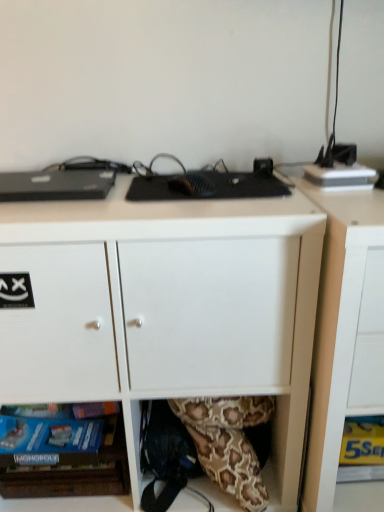
This screenshot has height=512, width=384. I want to click on wooden board games at lower left, so click(x=74, y=472).

Find the location of a particular element. This screenshot has width=384, height=512. yellow paper at lower right is located at coordinates (363, 441).

Image resolution: width=384 pixels, height=512 pixels. Describe the element at coordinates (344, 329) in the screenshot. I see `matte white cabinet at lower right` at that location.

The height and width of the screenshot is (512, 384). Identify the location of wooden board games at lower left. (74, 472).

Looking at their sizes, would you say wooden board games at lower left is wider or thinner than white matte desk at center?

wooden board games at lower left is thinner than white matte desk at center.

Relative to white matte desk at center, is wooden board games at lower left in front or behind?

wooden board games at lower left is positioned farther from the viewer than white matte desk at center.

From a real-world perspective, is wooden board games at lower left physically below white matte desk at center?

Yes.

Which of these two, wooden board games at lower left or white matte desk at center, stands taller?

With more height is white matte desk at center.

In the scene shown: From the image's perspective, does wooden board games at lower left appear lower than matte white cabinet at lower right?

Correct, wooden board games at lower left appears lower than matte white cabinet at lower right in the image.

Does point (88, 471) appear closer or farther from the camera than point (327, 337)?

Point (88, 471) appears to be farther away from the viewer than point (327, 337).

Where is `cabinetry above the wooden board games at lower left (from the image's perspective)`? The width and height of the screenshot is (384, 512). cabinetry above the wooden board games at lower left (from the image's perspective) is located at coordinates (344, 329).

Who is more distant, wooden board games at lower left or matte white cabinet at lower right?

Positioned behind is wooden board games at lower left.

Which is more to the right, yellow paper at lower right or wooden board games at lower left?

Positioned to the right is yellow paper at lower right.

You are a GUI agent. You are given a task and a screenshot of the screen. Output one action in this format:
    pyautogui.click(x=<x>, y=<y>)
    Task: Click on the paperback book on the right of wooden board games at lower left
    Image resolution: width=384 pixels, height=512 pixels.
    Given the screenshot: What is the action you would take?
    [363, 441]

From a real-world perspective, between yellow paper at lower right and wooden board games at lower left, who is vertically higher?

From a 3D spatial view, yellow paper at lower right is above.

Is matte white cabinet at lower right next to white matte desk at center and touching it?

No, matte white cabinet at lower right is not with white matte desk at center.

Between matte white cabinet at lower right and white matte desk at center, which one has larger width?

white matte desk at center is wider.

Is white matte desk at center inside matte white cabinet at lower right?

Definitely not — white matte desk at center is not inside matte white cabinet at lower right.

From the image's perspective, who appears lower, matte white cabinet at lower right or white matte desk at center?

matte white cabinet at lower right.

Image resolution: width=384 pixels, height=512 pixels. I want to click on desk above the yellow paper at lower right (from a real-world perspective), so click(166, 309).

Between point (343, 431) and point (125, 362), which one is positioned in front?

Point (125, 362)

From a real-world perspective, is yellow paper at lower right above or below white matte desk at center?

yellow paper at lower right is below white matte desk at center.

Does yellow paper at lower right turn towards white matte desk at center?

No, yellow paper at lower right does not turn towards white matte desk at center.

Can you confirm if wooden board games at lower left is positioned to the left of yellow paper at lower right?

Correct, you'll find wooden board games at lower left to the left of yellow paper at lower right.

From the image's perspective, which is above, wooden board games at lower left or yellow paper at lower right?

From the image's view, yellow paper at lower right is above.

Is yellow paper at lower right inside wooden board games at lower left?

No, yellow paper at lower right is located outside of wooden board games at lower left.

Is wooden board games at lower left facing towards yellow paper at lower right?

No, wooden board games at lower left is not facing towards yellow paper at lower right.

Where is `shelf located on the left of white matte desk at center`? This screenshot has height=512, width=384. shelf located on the left of white matte desk at center is located at coordinates (74, 472).

Can you confirm if white matte desk at center is positioned to the left of wooden board games at lower left?

No, white matte desk at center is not to the left of wooden board games at lower left.

What's the angular difference between white matte desk at center and wooden board games at lower left's facing directions?

The angular difference between white matte desk at center and wooden board games at lower left is 3.22 degrees.

Is point (28, 401) positioned before point (55, 488)?

That is True.

Identify the location of shelf that is below the white matte desk at center (from the image's perspective). (74, 472).

Find the location of `shelf that is under the matte white cabinet at lower right (from a real-world perspective)`. shelf that is under the matte white cabinet at lower right (from a real-world perspective) is located at coordinates (74, 472).

From the image, which object appears to be nearer to white matte desk at center, matte white cabinet at lower right or yellow paper at lower right?

matte white cabinet at lower right.

When comparing their distances from white matte desk at center, does wooden board games at lower left or matte white cabinet at lower right seem further?

wooden board games at lower left.

Estimate the real-world distances between objects in this image. Which object is further from white matte desk at center, yellow paper at lower right or wooden board games at lower left?

Among the two, yellow paper at lower right is located further to white matte desk at center.

From the picture: Which object lies further to the anchor point yellow paper at lower right, white matte desk at center or wooden board games at lower left?

wooden board games at lower left.

Based on their spatial positions, is white matte desk at center or yellow paper at lower right closer to matte white cabinet at lower right?

white matte desk at center is positioned closer to the anchor matte white cabinet at lower right.

Based on their spatial positions, is wooden board games at lower left or matte white cabinet at lower right closer to yellow paper at lower right?

Based on the image, matte white cabinet at lower right appears to be nearer to yellow paper at lower right.

Based on the photo, when comparing their distances from white matte desk at center, does yellow paper at lower right or matte white cabinet at lower right seem further?

Based on the image, yellow paper at lower right appears to be further to white matte desk at center.

Considering their positions, is wooden board games at lower left positioned further to matte white cabinet at lower right than yellow paper at lower right?

wooden board games at lower left is positioned further to the anchor matte white cabinet at lower right.

Image resolution: width=384 pixels, height=512 pixels. I want to click on cabinetry situated between wooden board games at lower left and yellow paper at lower right from left to right, so click(344, 329).

The height and width of the screenshot is (512, 384). Find the location of `cabinetry between white matte desk at center and yellow paper at lower right in the horizontal direction`. cabinetry between white matte desk at center and yellow paper at lower right in the horizontal direction is located at coordinates (344, 329).

Identify the location of desk between wooden board games at lower left and yellow paper at lower right. [x=166, y=309].

Where is `desk located between wooden board games at lower left and matte white cabinet at lower right in the left-right direction`? desk located between wooden board games at lower left and matte white cabinet at lower right in the left-right direction is located at coordinates (166, 309).